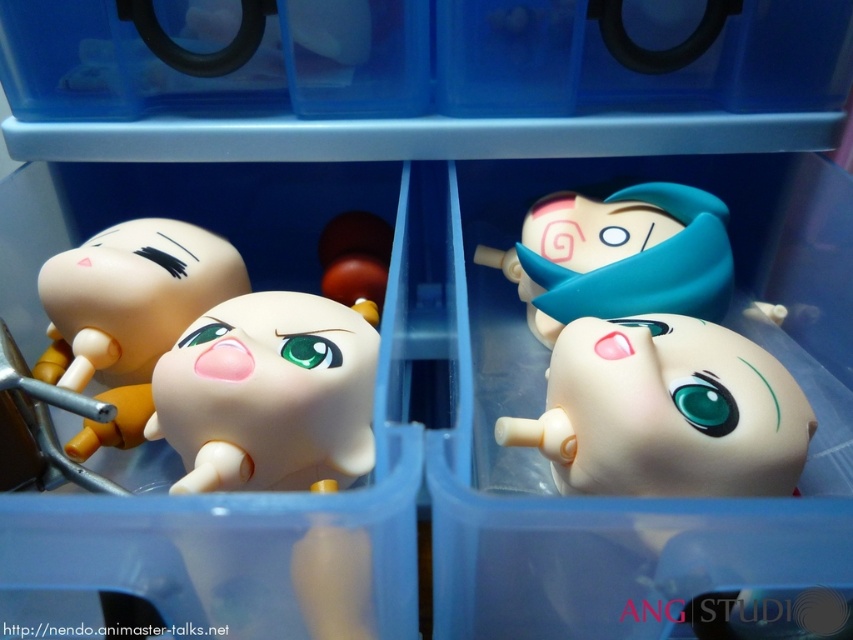
What are the coordinates of the matte plastic toy at center in the image?

The coordinates of the matte plastic toy at center are at point (128, 314).

You are holding a camera and want to take a photo of the point located at coordinates point [184,356]. The camera is currently 23.31 inches away from the point. If the camera needs to be exactly 24 inches away to get a clear shot, should you move closer or farther away?

The camera is currently 23.31 inches away from the point, which is closer than the required 24 inches. To achieve the desired distance for a clear shot, you should move the camera slightly farther away from the point.

You are organizing the figurines in the blue plastic storage container. You need to place a new figurine exactly at the center of the container. Is the white glossy figurine at center currently occupying that spot?

The white glossy figurine at center is located at point (268, 394), which is not exactly the center of the container. The center would be at point (426, 320). Therefore, the white glossy figurine at center is slightly to the right and above the true center of the container.